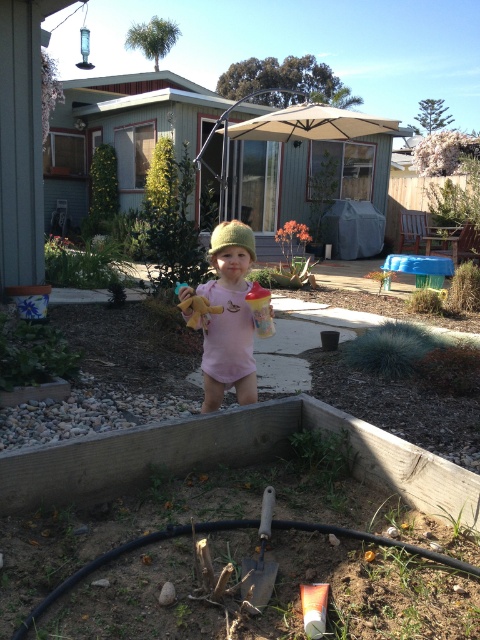
Measure the distance between wooden shovel at center and camera.

wooden shovel at center and camera are 6.75 feet apart from each other.

Between point (266, 516) and point (23, 310), which one is positioned behind?

The point (23, 310) is behind.

Is point (265, 579) closer to viewer compared to point (47, 294)?

That is True.

The height and width of the screenshot is (640, 480). Identify the location of wooden shovel at center. (260, 561).

Does blue fabric flower bed at lower left lie in front of knitted green hat at center?

No, blue fabric flower bed at lower left is behind knitted green hat at center.

Between blue fabric flower bed at lower left and knitted green hat at center, which one has more height?

knitted green hat at center is taller.

Does point (31, 310) come closer to viewer compared to point (244, 248)?

No, (31, 310) is behind (244, 248).

Find the location of `blue fabric flower bed at lower left`. blue fabric flower bed at lower left is located at coordinates (31, 300).

Does black rubber garden hose at lower center appear on the right side of blue fabric flower bed at lower left?

Yes, black rubber garden hose at lower center is to the right of blue fabric flower bed at lower left.

Consider the image. Is black rubber garden hose at lower center bigger than blue fabric flower bed at lower left?

Yes.

Does point (300, 525) come closer to viewer compared to point (28, 320)?

Yes, point (300, 525) is closer to viewer.

Locate an element on the screen. The width and height of the screenshot is (480, 640). black rubber garden hose at lower center is located at coordinates (123, 554).